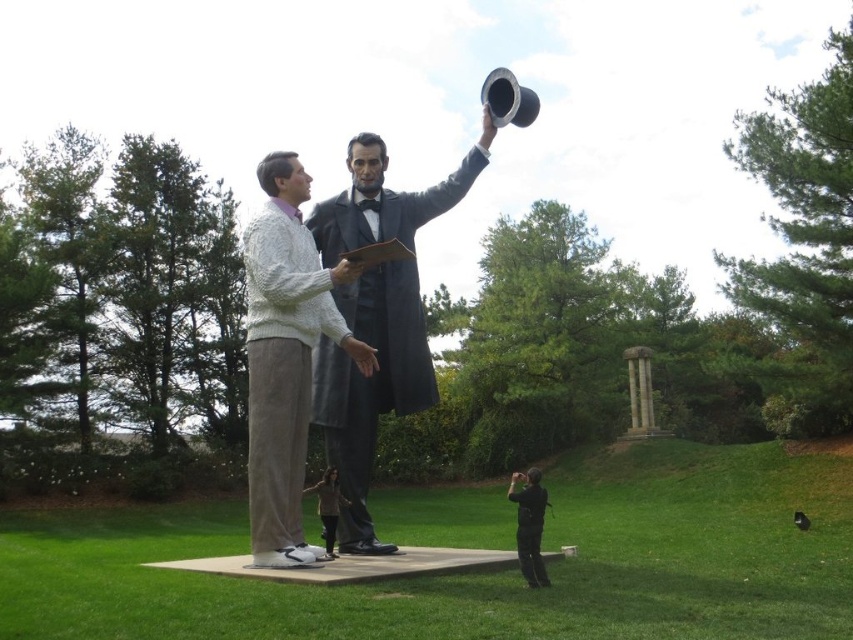
Question: In this image, where is smooth gray suit at center located relative to brown fabric jacket at lower center?

Choices:
 (A) above
 (B) below

Answer: (A)

Question: Can you confirm if smooth gray suit at center is thinner than brown fabric jacket at lower center?

Choices:
 (A) yes
 (B) no

Answer: (A)

Question: Considering the real-world distances, which object is closest to the white knitted sweater at center?

Choices:
 (A) brown fabric jacket at lower center
 (B) smooth gray suit at center

Answer: (B)

Question: Among these points, which one is nearest to the camera?

Choices:
 (A) (248, 326)
 (B) (334, 524)
 (C) (381, 212)

Answer: (A)

Question: Does smooth gray suit at center come in front of white knitted sweater at center?

Choices:
 (A) yes
 (B) no

Answer: (B)

Question: Which point is closer to the camera?

Choices:
 (A) white knitted sweater at center
 (B) smooth gray suit at center

Answer: (A)